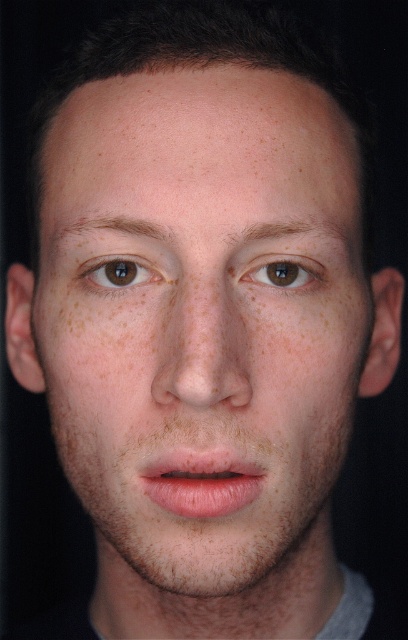
Please describe the location of the brown matte eye at upper left in the image using coordinates. The answer should be in the format of coordinates like this example format, e.g., at point 0.427, 0.294.

The brown matte eye at upper left is located at point (119, 273).

You are a photographer adjusting the lighting for a closeup portrait. You notice the natural skin tone freckled face at center and the brown matte eye at center. Which object is positioned lower in the image?

The natural skin tone freckled face at center is located below the brown matte eye at center, so the natural skin tone freckled face at center is positioned lower in the image.

In the scene shown: You are a photographer adjusting lighting for a portrait. You notice the natural skin tone freckled face at center and the brown matte eye at upper left. Which object is located lower in the frame?

The natural skin tone freckled face at center is positioned under the brown matte eye at upper left, so the natural skin tone freckled face at center is lower in the frame.